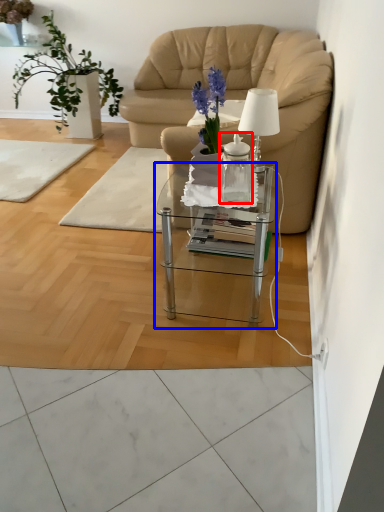
Question: Among these objects, which one is nearest to the camera, vase (highlighted by a red box) or coffee table (highlighted by a blue box)?

Choices:
 (A) vase
 (B) coffee table

Answer: (B)